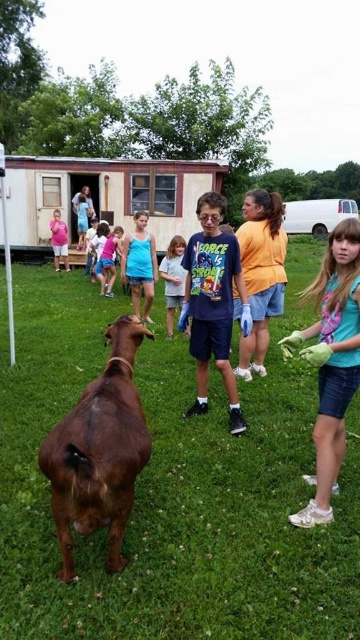
Question: Which of the following is the closest to the observer?

Choices:
 (A) (253, 262)
 (B) (336, 228)

Answer: (B)

Question: Observing the image, what is the correct spatial positioning of brown grass at center in reference to orange cotton shirt at center?

Choices:
 (A) right
 (B) left

Answer: (B)

Question: Among these objects, which one is nearest to the camera?

Choices:
 (A) light blue t-shirt at center
 (B) orange cotton shirt at center

Answer: (A)

Question: Which of the following is the farthest from the observer?

Choices:
 (A) (24, 321)
 (B) (276, 212)

Answer: (A)

Question: Considering the relative positions of brown grass at center and light blue t-shirt at center in the image provided, where is brown grass at center located with respect to light blue t-shirt at center?

Choices:
 (A) left
 (B) right

Answer: (A)

Question: Does brown grass at center appear over white cotton shirt at center?

Choices:
 (A) yes
 (B) no

Answer: (B)